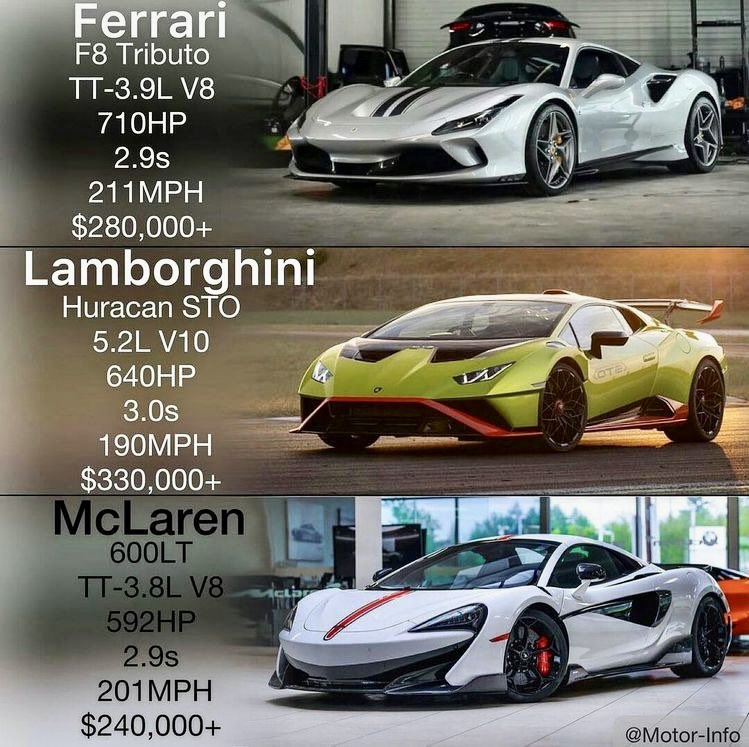
Identify the location of garage floor. (640, 192).